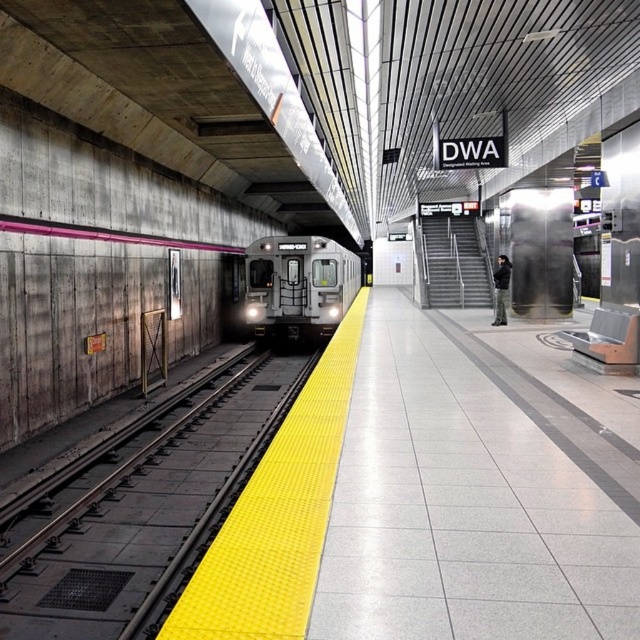
You are standing on the subway platform and want to determine which of the two points, point (177, 518) or point (288, 266), is closer to you. Based on the scene, which point is nearer?

Point (177, 518) is closer to the viewer than point (288, 266).

You are standing at the point marked as point (140,512) on the subway platform. What is directly beneath your feet?

The yellow textured platform at center is directly beneath your feet at point (140,512).